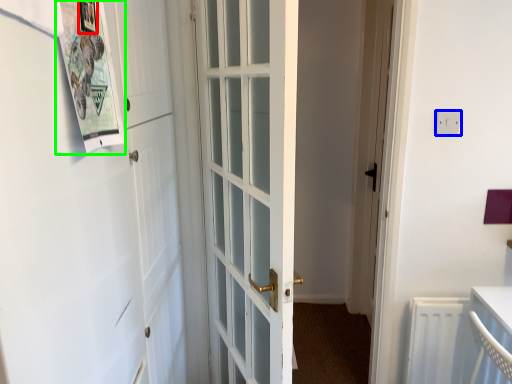
Question: Considering the real-world distances, which object is closest to picture frame (highlighted by a red box)? electric outlet (highlighted by a blue box) or bulletin board (highlighted by a green box).

Choices:
 (A) electric outlet
 (B) bulletin board

Answer: (B)